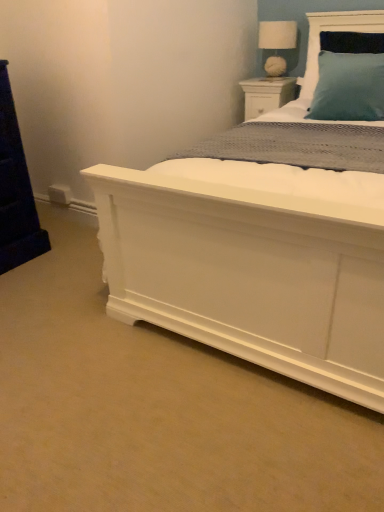
Question: Considering the positions of white wood nightstand at upper right and white fabric lampshade at upper center in the image, is white wood nightstand at upper right wider or thinner than white fabric lampshade at upper center?

Choices:
 (A) thin
 (B) wide

Answer: (B)

Question: From the image's perspective, is white wood nightstand at upper right above or below white fabric lampshade at upper center?

Choices:
 (A) below
 (B) above

Answer: (A)

Question: Considering the positions of white wood nightstand at upper right and white fabric lampshade at upper center in the image, is white wood nightstand at upper right taller or shorter than white fabric lampshade at upper center?

Choices:
 (A) tall
 (B) short

Answer: (B)

Question: From the image's perspective, is white fabric lampshade at upper center located above or below white wood nightstand at upper right?

Choices:
 (A) below
 (B) above

Answer: (B)

Question: Is white fabric lampshade at upper center in front of or behind white wood nightstand at upper right in the image?

Choices:
 (A) behind
 (B) front

Answer: (B)

Question: Is white fabric lampshade at upper center taller or shorter than white wood nightstand at upper right?

Choices:
 (A) short
 (B) tall

Answer: (B)

Question: Considering the positions of point (284, 39) and point (291, 76), is point (284, 39) closer or farther from the camera than point (291, 76)?

Choices:
 (A) farther
 (B) closer

Answer: (B)